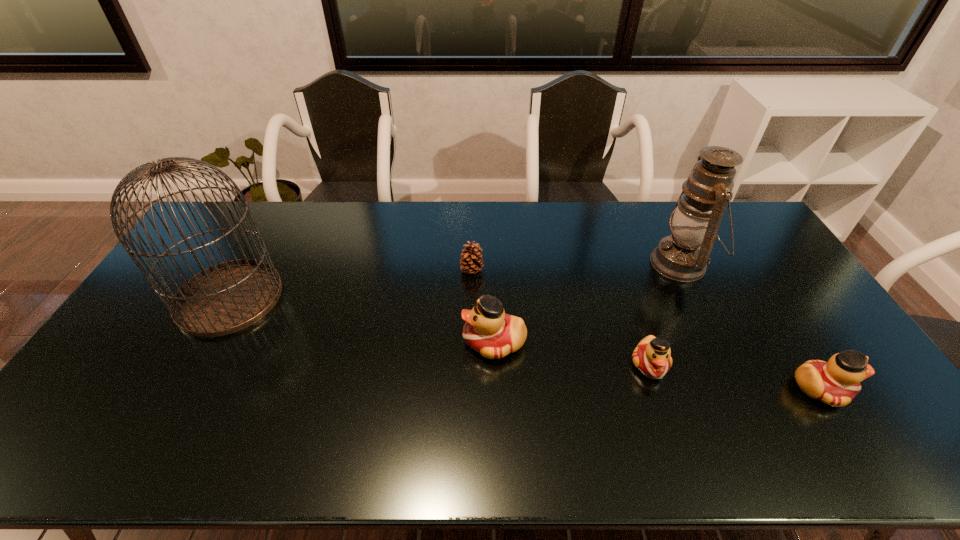
Please point a spot on the left to add another duck. Please provide its 2D coordinates. Your answer should be formatted as a tuple, i.e. [(x, y)], where the tuple contains the x and y coordinates of a point satisfying the conditions above.

[(351, 321)]